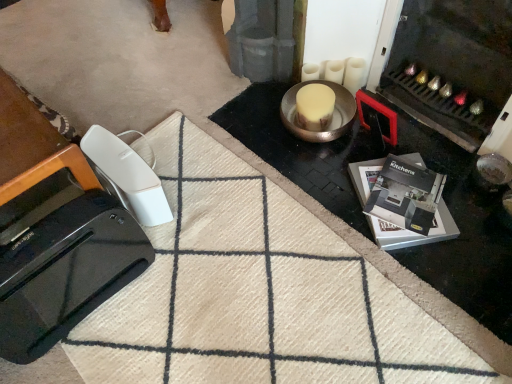
The width and height of the screenshot is (512, 384). Identify the location of white plastic remote at lower left, marked as the second home appliance in a front-to-back arrangement. (128, 174).

Measure the distance between black glossy kitchens brochure at lower right and camera.

The distance of black glossy kitchens brochure at lower right from camera is 1.38 meters.

What is the approximate height of beige woolen doormat at lower left?

It is 1.65 inches.

This screenshot has width=512, height=384. What are the coordinates of `black glossy toaster at lower left, the 1th home appliance from the front` in the screenshot? It's located at point(65,269).

Between point (126, 132) and point (0, 350), which one is positioned in front?

Positioned in front is point (0, 350).

Find the location of a particular element. home appliance that appears above the white plastic remote at lower left, the 1th home appliance from the back (from a real-world perspective) is located at coordinates (65, 269).

Is white plastic remote at lower left, the 1th home appliance from the back, positioned far away from black glossy toaster at lower left, acting as the 2th home appliance starting from the back?

That's not correct — white plastic remote at lower left, the 1th home appliance from the back, is a little close to black glossy toaster at lower left, acting as the 2th home appliance starting from the back.

Can black glossy toaster at lower left, acting as the 2th home appliance starting from the back, be found inside white plastic remote at lower left, the 1th home appliance from the back?

No.

From the picture: Can you confirm if black glossy toaster at lower left, acting as the 2th home appliance starting from the back, is taller than black glossy kitchens brochure at lower right?

Indeed, black glossy toaster at lower left, acting as the 2th home appliance starting from the back, has a greater height compared to black glossy kitchens brochure at lower right.

Locate an element on the screen. The height and width of the screenshot is (384, 512). home appliance located below the black glossy kitchens brochure at lower right (from the image's perspective) is located at coordinates (65, 269).

Relative to black glossy kitchens brochure at lower right, is black glossy toaster at lower left, acting as the 2th home appliance starting from the back, in front or behind?

Clearly, black glossy toaster at lower left, acting as the 2th home appliance starting from the back, is in front of black glossy kitchens brochure at lower right.

Is the surface of black glossy toaster at lower left, the 1th home appliance from the front, in direct contact with black glossy kitchens brochure at lower right?

No, black glossy toaster at lower left, the 1th home appliance from the front, is not with black glossy kitchens brochure at lower right.

From a real-world perspective, is black glossy toaster at lower left, acting as the 2th home appliance starting from the back, above or below white plastic remote at lower left, the 1th home appliance from the back?

Clearly, from a real-world perspective, black glossy toaster at lower left, acting as the 2th home appliance starting from the back, is above white plastic remote at lower left, the 1th home appliance from the back.

From the image's perspective, between black glossy toaster at lower left, acting as the 2th home appliance starting from the back, and white plastic remote at lower left, marked as the second home appliance in a front-to-back arrangement, which one is located above?

white plastic remote at lower left, marked as the second home appliance in a front-to-back arrangement, appears higher in the image.

Does black glossy toaster at lower left, the 1th home appliance from the front, have a smaller size compared to white plastic remote at lower left, marked as the second home appliance in a front-to-back arrangement?

Incorrect, black glossy toaster at lower left, the 1th home appliance from the front, is not smaller in size than white plastic remote at lower left, marked as the second home appliance in a front-to-back arrangement.

Is black glossy toaster at lower left, the 1th home appliance from the front, shorter than white plastic remote at lower left, the 1th home appliance from the back?

No.

How far apart are black glossy toaster at lower left, acting as the 2th home appliance starting from the back, and beige woolen doormat at lower left?

black glossy toaster at lower left, acting as the 2th home appliance starting from the back, and beige woolen doormat at lower left are 11.72 inches apart.

From a real-world perspective, does black glossy toaster at lower left, acting as the 2th home appliance starting from the back, sit lower than beige woolen doormat at lower left?

No.

Who is bigger, black glossy toaster at lower left, acting as the 2th home appliance starting from the back, or beige woolen doormat at lower left?

beige woolen doormat at lower left is bigger.

Is the position of black glossy kitchens brochure at lower right more distant than that of white plastic remote at lower left, marked as the second home appliance in a front-to-back arrangement?

Yes, black glossy kitchens brochure at lower right is further from the viewer.

Does black glossy kitchens brochure at lower right appear on the right side of white plastic remote at lower left, marked as the second home appliance in a front-to-back arrangement?

Correct, you'll find black glossy kitchens brochure at lower right to the right of white plastic remote at lower left, marked as the second home appliance in a front-to-back arrangement.

Considering the positions of points (404, 159) and (140, 217), is point (404, 159) closer to camera compared to point (140, 217)?

No, it is behind (140, 217).

Are black glossy kitchens brochure at lower right and white plastic remote at lower left, marked as the second home appliance in a front-to-back arrangement, far apart?

Actually, black glossy kitchens brochure at lower right and white plastic remote at lower left, marked as the second home appliance in a front-to-back arrangement, are a little close together.

How much distance is there between beige woolen doormat at lower left and black glossy kitchens brochure at lower right?

beige woolen doormat at lower left and black glossy kitchens brochure at lower right are 15.67 inches apart from each other.

Is point (178, 218) positioned before point (376, 235)?

No, (178, 218) is further to viewer.

In the image, is beige woolen doormat at lower left positioned in front of or behind black glossy kitchens brochure at lower right?

Clearly, beige woolen doormat at lower left is in front of black glossy kitchens brochure at lower right.

Is black glossy kitchens brochure at lower right located within beige woolen doormat at lower left?

No, black glossy kitchens brochure at lower right is located outside of beige woolen doormat at lower left.

Is beige woolen doormat at lower left spatially inside black glossy toaster at lower left, acting as the 2th home appliance starting from the back, or outside of it?

beige woolen doormat at lower left is located beyond the bounds of black glossy toaster at lower left, acting as the 2th home appliance starting from the back.

How different are the orientations of beige woolen doormat at lower left and black glossy toaster at lower left, the 1th home appliance from the front, in degrees?

The facing directions of beige woolen doormat at lower left and black glossy toaster at lower left, the 1th home appliance from the front, are 87.5 degrees apart.

Considering their positions, is beige woolen doormat at lower left located in front of or behind black glossy toaster at lower left, the 1th home appliance from the front?

beige woolen doormat at lower left is in front of black glossy toaster at lower left, the 1th home appliance from the front.

Locate an element on the screen. home appliance on the left of white plastic remote at lower left, the 1th home appliance from the back is located at coordinates (65, 269).

You are a GUI agent. You are given a task and a screenshot of the screen. Output one action in this format:
    pyautogui.click(x=<x>, y=<y>)
    Task: Click on the home appliance that is the 2nd one when counting forward from the black glossy kitchens brochure at lower right
    This screenshot has height=384, width=512.
    Given the screenshot: What is the action you would take?
    pyautogui.click(x=65, y=269)

Consider the image. Based on their spatial positions, is black glossy toaster at lower left, acting as the 2th home appliance starting from the back, or white plastic remote at lower left, the 1th home appliance from the back, further from black glossy kitchens brochure at lower right?

black glossy toaster at lower left, acting as the 2th home appliance starting from the back, is positioned further to the anchor black glossy kitchens brochure at lower right.

Which object lies further to the anchor point black glossy toaster at lower left, the 1th home appliance from the front, black glossy kitchens brochure at lower right or white plastic remote at lower left, marked as the second home appliance in a front-to-back arrangement?

black glossy kitchens brochure at lower right lies further to black glossy toaster at lower left, the 1th home appliance from the front, than the other object.

When comparing their distances from black glossy kitchens brochure at lower right, does beige woolen doormat at lower left or black glossy toaster at lower left, the 1th home appliance from the front, seem further?

Based on the image, black glossy toaster at lower left, the 1th home appliance from the front, appears to be further to black glossy kitchens brochure at lower right.

From the picture: Based on their spatial positions, is black glossy kitchens brochure at lower right or black glossy toaster at lower left, the 1th home appliance from the front, closer to beige woolen doormat at lower left?

black glossy toaster at lower left, the 1th home appliance from the front.

Which object lies nearer to the anchor point black glossy kitchens brochure at lower right, white plastic remote at lower left, the 1th home appliance from the back, or beige woolen doormat at lower left?

Based on the image, beige woolen doormat at lower left appears to be nearer to black glossy kitchens brochure at lower right.

Estimate the real-world distances between objects in this image. Which object is further from white plastic remote at lower left, the 1th home appliance from the back, black glossy kitchens brochure at lower right or beige woolen doormat at lower left?

black glossy kitchens brochure at lower right.

When comparing their distances from black glossy toaster at lower left, acting as the 2th home appliance starting from the back, does beige woolen doormat at lower left or black glossy kitchens brochure at lower right seem further?

black glossy kitchens brochure at lower right is positioned further to the anchor black glossy toaster at lower left, acting as the 2th home appliance starting from the back.

Based on their spatial positions, is black glossy kitchens brochure at lower right or white plastic remote at lower left, the 1th home appliance from the back, further from beige woolen doormat at lower left?

Based on the image, black glossy kitchens brochure at lower right appears to be further to beige woolen doormat at lower left.

I want to click on doormat between black glossy toaster at lower left, acting as the 2th home appliance starting from the back, and black glossy kitchens brochure at lower right, in the horizontal direction, so click(263, 292).

Image resolution: width=512 pixels, height=384 pixels. In order to click on home appliance located between black glossy toaster at lower left, acting as the 2th home appliance starting from the back, and black glossy kitchens brochure at lower right in the left-right direction in this screenshot , I will do `click(128, 174)`.

The image size is (512, 384). What are the coordinates of `home appliance between beige woolen doormat at lower left and white plastic remote at lower left, marked as the second home appliance in a front-to-back arrangement, in the front-back direction` in the screenshot? It's located at (65, 269).

This screenshot has width=512, height=384. In order to click on doormat between white plastic remote at lower left, marked as the second home appliance in a front-to-back arrangement, and black glossy kitchens brochure at lower right in this screenshot , I will do `click(263, 292)`.